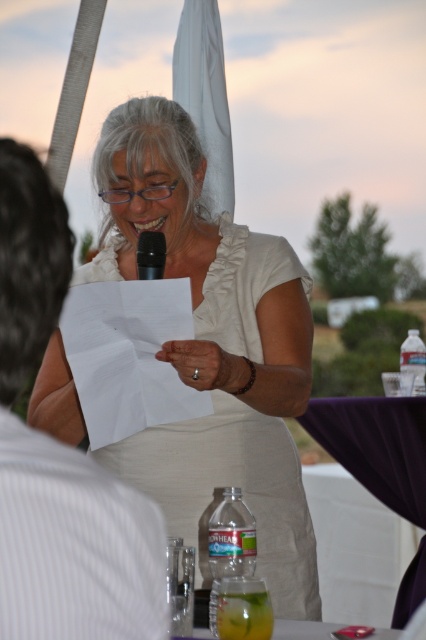
Which is in front, point (187, 221) or point (111, 564)?

Point (111, 564) is more forward.

Image resolution: width=426 pixels, height=640 pixels. What do you see at coordinates (213, 348) in the screenshot?
I see `white satin dress at center` at bounding box center [213, 348].

You are a GUI agent. You are given a task and a screenshot of the screen. Output one action in this format:
    pyautogui.click(x=<x>, y=<y>)
    Task: Click on the white satin dress at center
    The width and height of the screenshot is (426, 640).
    Given the screenshot: What is the action you would take?
    click(x=213, y=348)

The image size is (426, 640). I want to click on white striped shirt at left, so click(x=60, y=456).

Can you confirm if white striped shirt at left is shorter than black matte microphone at center?

In fact, white striped shirt at left may be taller than black matte microphone at center.

Identify the location of white striped shirt at left. (60, 456).

Which is more to the left, white satin dress at center or black matte microphone at center?

From the viewer's perspective, black matte microphone at center appears more on the left side.

Between white satin dress at center and black matte microphone at center, which one is positioned lower?

Positioned lower is white satin dress at center.

What do you see at coordinates (213, 348) in the screenshot?
I see `white satin dress at center` at bounding box center [213, 348].

At what (x,y) coordinates should I click in order to perform the action: click on white satin dress at center. Please return your answer as a coordinate pair (x, y). This screenshot has width=426, height=640. Looking at the image, I should click on (213, 348).